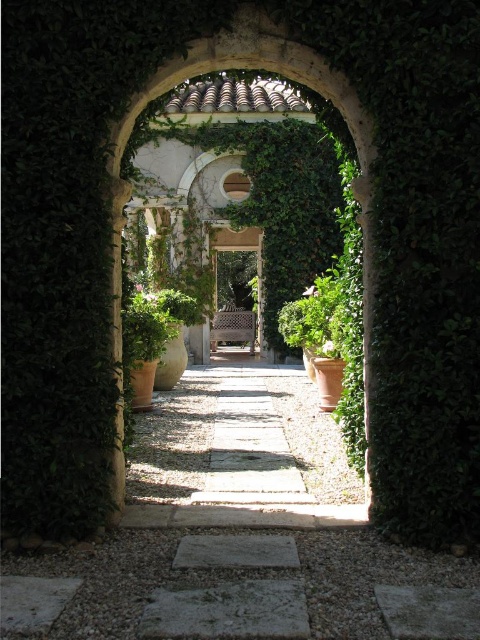
Question: Is smooth stone path at center smaller than wooden bench at center?

Choices:
 (A) no
 (B) yes

Answer: (B)

Question: Which object appears closest to the camera in this image?

Choices:
 (A) smooth stone path at center
 (B) wooden bench at center

Answer: (A)

Question: Among these objects, which one is farthest from the camera?

Choices:
 (A) smooth stone path at center
 (B) wooden bench at center

Answer: (B)

Question: Can you confirm if smooth stone path at center is positioned to the left of wooden bench at center?

Choices:
 (A) no
 (B) yes

Answer: (A)

Question: Can you confirm if smooth stone path at center is positioned below wooden bench at center?

Choices:
 (A) no
 (B) yes

Answer: (B)